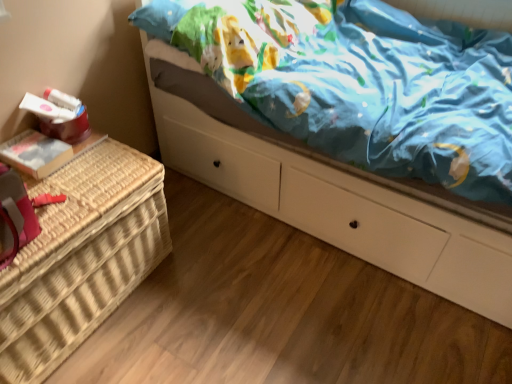
This screenshot has height=384, width=512. Describe the element at coordinates (81, 257) in the screenshot. I see `woven wicker basket at left` at that location.

You are a GUI agent. You are given a task and a screenshot of the screen. Output one action in this format:
    pyautogui.click(x=<x>, y=<y>)
    Task: Click on the woven wicker basket at left
    This screenshot has height=384, width=512.
    Given the screenshot: What is the action you would take?
    tap(81, 257)

What do you see at coordinates (337, 204) in the screenshot? I see `white glossy bed at upper center` at bounding box center [337, 204].

Locate an element on the screen. white glossy bed at upper center is located at coordinates 337,204.

At what (x,y) coordinates should I click in order to perform the action: click on woven wicker basket at left. Please return your answer as a coordinate pair (x, y). This screenshot has height=384, width=512. Looking at the image, I should click on 81,257.

Which object is positioned more to the right, woven wicker basket at left or white glossy bed at upper center?

white glossy bed at upper center.

Is woven wicker basket at left positioned in front of white glossy bed at upper center?

No, woven wicker basket at left is behind white glossy bed at upper center.

Which is in front, point (65, 286) or point (149, 76)?

Point (65, 286)

From the image's perspective, is woven wicker basket at left above white glossy bed at upper center?

No, from the image's perspective, woven wicker basket at left is not above white glossy bed at upper center.

From a real-world perspective, between woven wicker basket at left and white glossy bed at upper center, who is vertically higher?

white glossy bed at upper center is physically above.

Can you confirm if woven wicker basket at left is thinner than white glossy bed at upper center?

Yes.

Does woven wicker basket at left have a lesser height compared to white glossy bed at upper center?

Yes, woven wicker basket at left is shorter than white glossy bed at upper center.

Looking at the image, does woven wicker basket at left seem bigger or smaller compared to white glossy bed at upper center?

→ In the image, woven wicker basket at left appears to be smaller than white glossy bed at upper center.

Which is correct: woven wicker basket at left is inside white glossy bed at upper center, or outside of it?

woven wicker basket at left exists outside the volume of white glossy bed at upper center.

Is woven wicker basket at left far away from white glossy bed at upper center?

They are positioned close to each other.

Is woven wicker basket at left facing away from white glossy bed at upper center?

That's not correct — woven wicker basket at left is not looking away from white glossy bed at upper center.

Looking at this image, how different are the orientations of woven wicker basket at left and white glossy bed at upper center in degrees?

The facing directions of woven wicker basket at left and white glossy bed at upper center are 91.1 degrees apart.

Where is `furniture on the left of white glossy bed at upper center`? This screenshot has height=384, width=512. furniture on the left of white glossy bed at upper center is located at coordinates (81, 257).

Which is more to the left, white glossy bed at upper center or woven wicker basket at left?

woven wicker basket at left.

Considering the positions of objects white glossy bed at upper center and woven wicker basket at left in the image provided, who is in front, white glossy bed at upper center or woven wicker basket at left?

white glossy bed at upper center is more forward.

Considering the positions of points (378, 255) and (25, 382), is point (378, 255) farther from camera compared to point (25, 382)?

Yes.

From the image's perspective, does white glossy bed at upper center appear higher than woven wicker basket at left?

Yes, from the image's perspective, white glossy bed at upper center is on top of woven wicker basket at left.

From a real-world perspective, between white glossy bed at upper center and woven wicker basket at left, who is vertically higher?

white glossy bed at upper center, from a real-world perspective.

Between white glossy bed at upper center and woven wicker basket at left, which one has smaller width?

woven wicker basket at left is thinner.

Consider the image. From their relative heights in the image, would you say white glossy bed at upper center is taller or shorter than woven wicker basket at left?

Clearly, white glossy bed at upper center is taller compared to woven wicker basket at left.

From the picture: Considering the relative sizes of white glossy bed at upper center and woven wicker basket at left in the image provided, is white glossy bed at upper center smaller than woven wicker basket at left?

Actually, white glossy bed at upper center might be larger than woven wicker basket at left.

Is white glossy bed at upper center outside of woven wicker basket at left?

white glossy bed at upper center lies outside woven wicker basket at left's area.

Are white glossy bed at upper center and woven wicker basket at left located far from each other?

That's not correct — white glossy bed at upper center is a little close to woven wicker basket at left.

Is white glossy bed at upper center oriented away from woven wicker basket at left?

That's not correct — white glossy bed at upper center is not looking away from woven wicker basket at left.

Can you tell me how much white glossy bed at upper center and woven wicker basket at left differ in facing direction?

91.1 degrees.

How distant is white glossy bed at upper center from woven wicker basket at left?

white glossy bed at upper center is 26.92 inches from woven wicker basket at left.

I want to click on bed on the right side of woven wicker basket at left, so click(x=337, y=204).

Where is `bed above the woven wicker basket at left (from the image's perspective)`? bed above the woven wicker basket at left (from the image's perspective) is located at coordinates (337, 204).

Where is `furniture beneath the white glossy bed at upper center (from a real-world perspective)`? furniture beneath the white glossy bed at upper center (from a real-world perspective) is located at coordinates (81, 257).